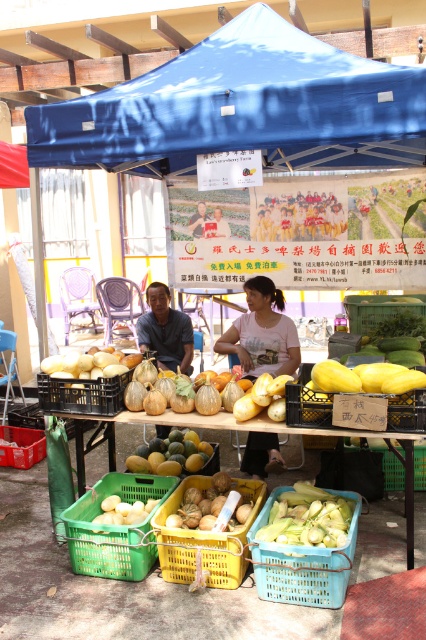
You are a customer at the stall and want to place a watermelon in the green plastic basket at lower left. However, you notice that the yellow matte melon basket at center is already holding several melons. How far apart are the two baskets?

The green plastic basket at lower left is 4.36 feet away from the yellow matte melon basket at center.

You are a customer at the fruit and vegetable stall. You want to pick up the green plastic basket at lower left. Which direction should you move relative to the yellow matte melon basket at center?

The green plastic basket at lower left is below the yellow matte melon basket at center, so you should move downward from the yellow matte melon basket at center to reach the green plastic basket at lower left.